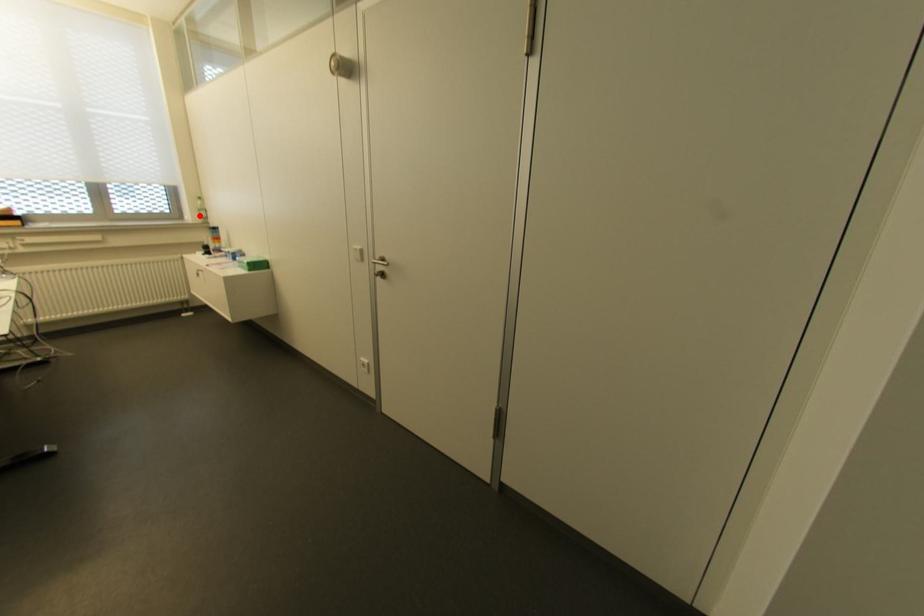
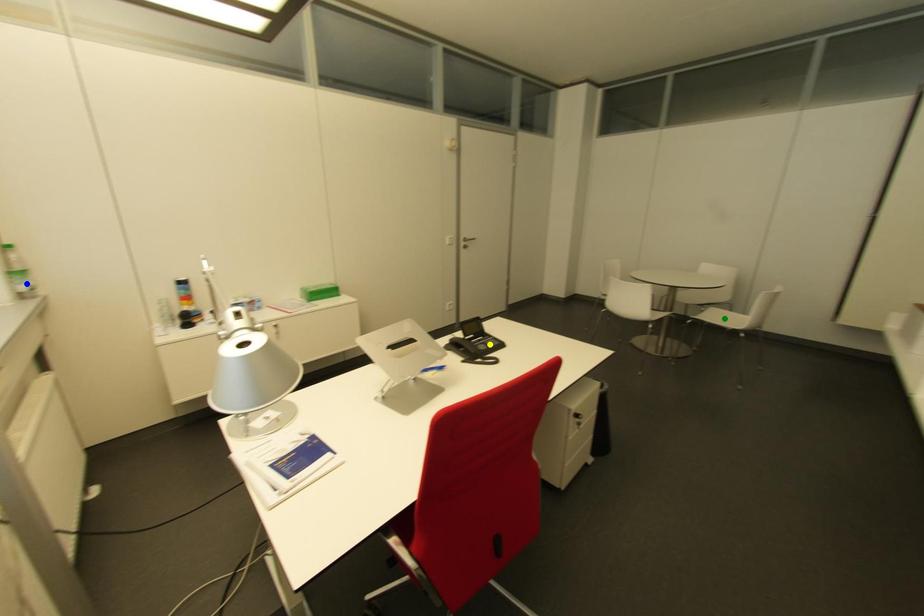
Question: I am providing you with two images of the same scene from different viewpoints. A red point is marked on the first image. You are given multiple points on the second image. Which spot in image 2 lines up with the point in image 1?

Choices:
 (A) yellow point
 (B) green point
 (C) blue point

Answer: (C)